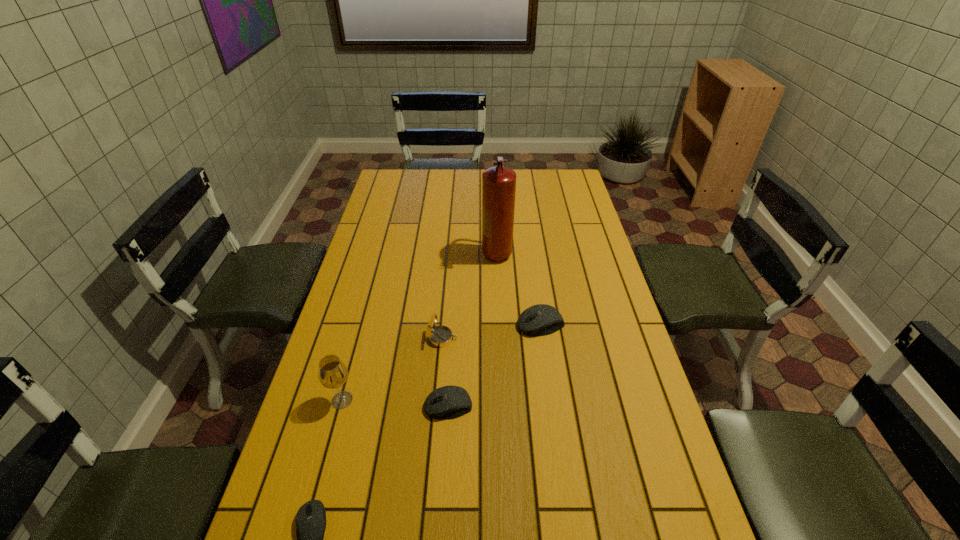
Where is `the second computer equipment from left to right`? This screenshot has height=540, width=960. the second computer equipment from left to right is located at coordinates (447, 402).

Identify the location of the second tallest computer equipment. (447, 402).

This screenshot has width=960, height=540. What are the coordinates of `the farthest computer equipment` in the screenshot? It's located at (541, 319).

The height and width of the screenshot is (540, 960). I want to click on the rightmost computer equipment, so click(x=541, y=319).

Find the location of a particular element. This screenshot has height=540, width=960. fire extinguisher is located at coordinates (498, 183).

Find the location of a particular element. The image size is (960, 540). the tallest object is located at coordinates (498, 183).

This screenshot has height=540, width=960. I want to click on the fourth shortest object, so click(x=438, y=336).

Locate an element on the screen. The height and width of the screenshot is (540, 960). the second tallest object is located at coordinates (332, 373).

Where is `vacant space located 0.080m on the right of the second shortest object`? vacant space located 0.080m on the right of the second shortest object is located at coordinates click(x=503, y=406).

The height and width of the screenshot is (540, 960). In order to click on blank space located on the front of the farthest computer equipment in this screenshot , I will do `click(551, 401)`.